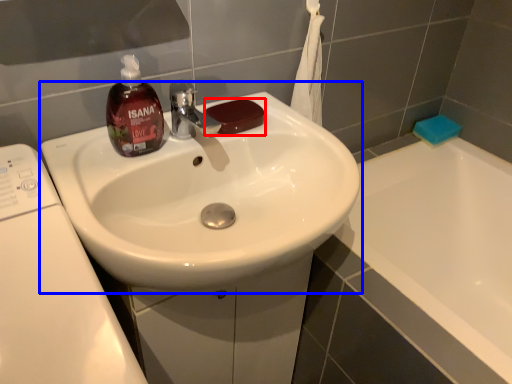
Question: Which point is further to the camera, soap (highlighted by a red box) or sink (highlighted by a blue box)?

Choices:
 (A) soap
 (B) sink

Answer: (A)